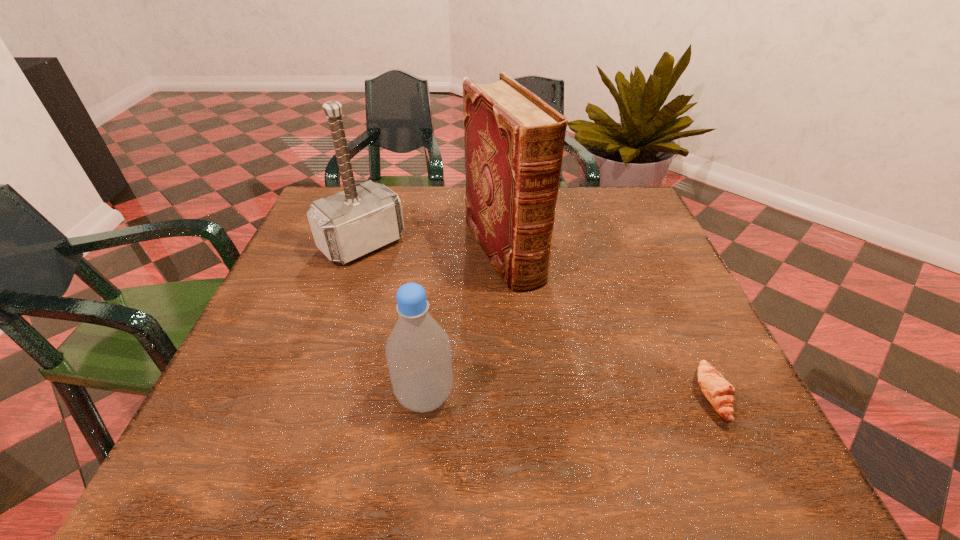
At what (x,y) coordinates should I click in order to perform the action: click on vacant region between the hardback book and the third tallest object. Please return your answer as a coordinate pair (x, y). Image resolution: width=960 pixels, height=540 pixels. Looking at the image, I should click on (465, 323).

Locate an element on the screen. This screenshot has width=960, height=540. free space between the bottle and the hammer is located at coordinates (394, 320).

Identify the location of free spot between the hammer and the bottle. The image size is (960, 540). (x=394, y=320).

The image size is (960, 540). In order to click on vacant space in between the hardback book and the rightmost object in this screenshot , I will do `click(609, 324)`.

Where is `blank region between the third object from left to right and the pastry`? The height and width of the screenshot is (540, 960). blank region between the third object from left to right and the pastry is located at coordinates [609, 324].

I want to click on free space between the second object from left to right and the hardback book, so click(x=465, y=323).

The height and width of the screenshot is (540, 960). In order to click on free spot between the pastry and the hammer in this screenshot , I will do `click(538, 320)`.

Identify which object is the third nearest to the leftmost object. Please provide its 2D coordinates. Your answer should be formatted as a tuple, i.e. [(x, y)], where the tuple contains the x and y coordinates of a point satisfying the conditions above.

[(719, 392)]

You are a GUI agent. You are given a task and a screenshot of the screen. Output one action in this format:
    pyautogui.click(x=<x>, y=<y>)
    Task: Click on the closest object to the leftmost object
    
    Given the screenshot: What is the action you would take?
    pyautogui.click(x=514, y=141)

I want to click on free spot that satisfies the following two spatial constraints: 1. on the front side of the third tallest object; 2. on the left side of the leftmost object, so click(311, 396).